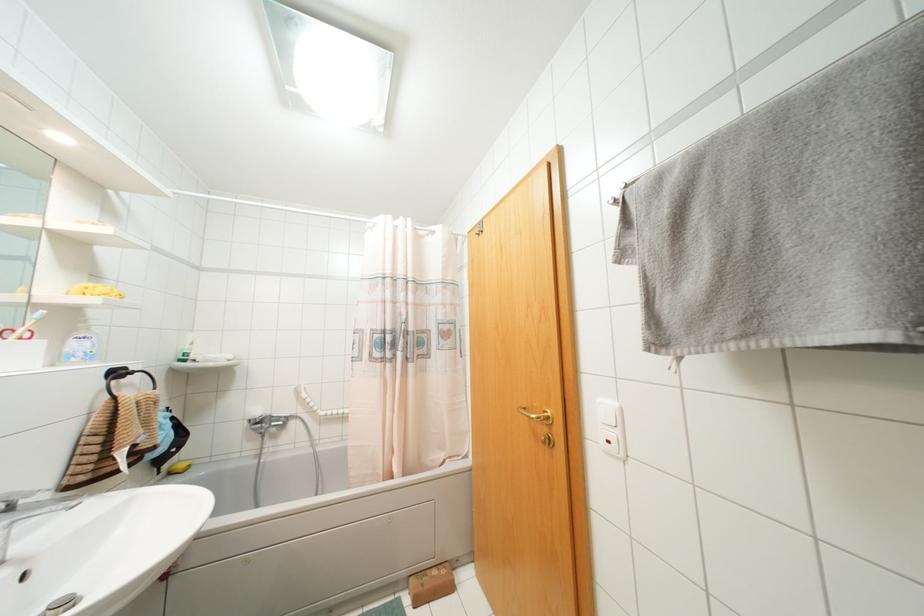
Identify the location of handheld shower head. The image size is (924, 616). (256, 418).